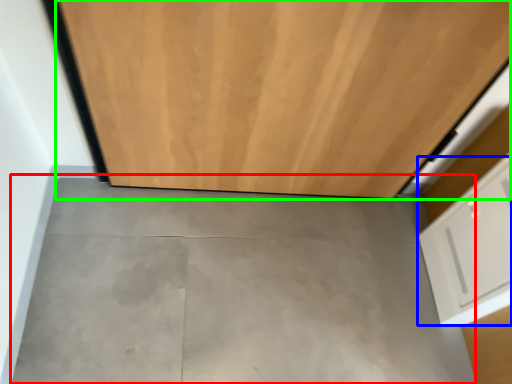
Question: Which object is positioned farthest from concrete (highlighted by a red box)? Select from drawer (highlighted by a blue box) and door (highlighted by a green box).

Choices:
 (A) drawer
 (B) door

Answer: (A)